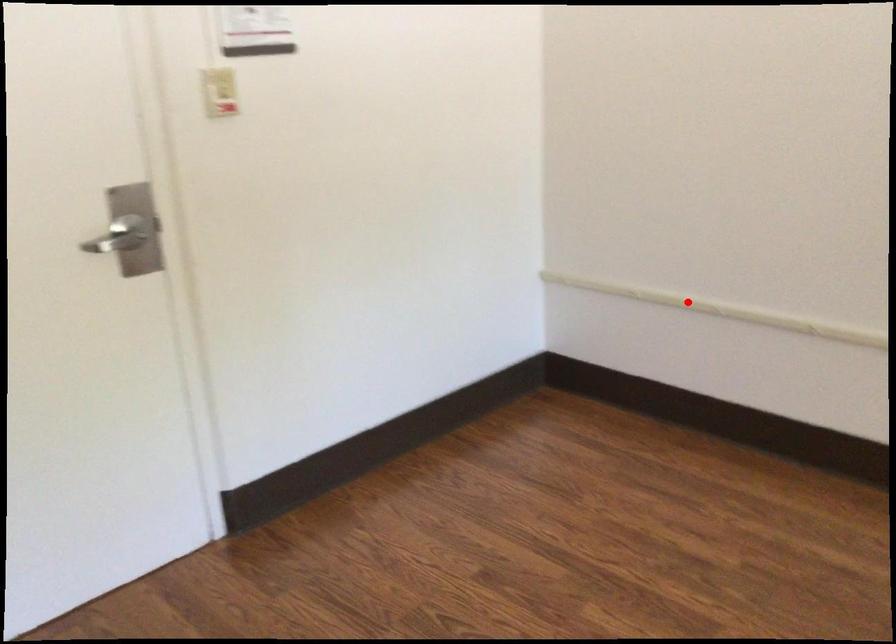
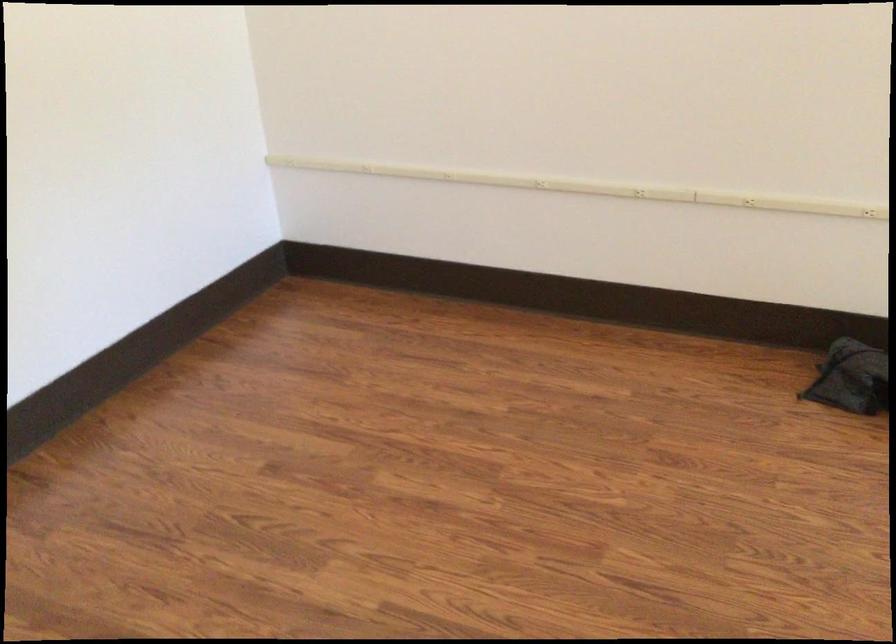
Where in the second image is the point corresponding to the highlighted location from the first image?

(421, 173)